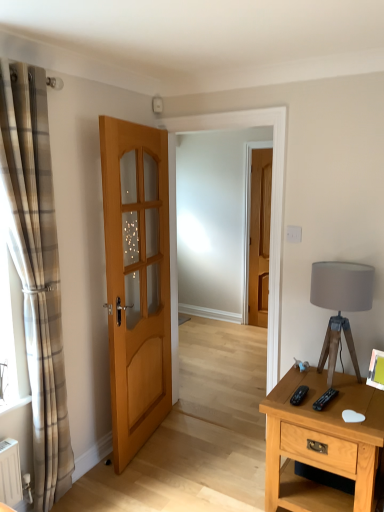
Where is `vacant region below light brown wooden door at center, the second door from the right (from a real-world perspective)`? vacant region below light brown wooden door at center, the second door from the right (from a real-world perspective) is located at coordinates (153, 440).